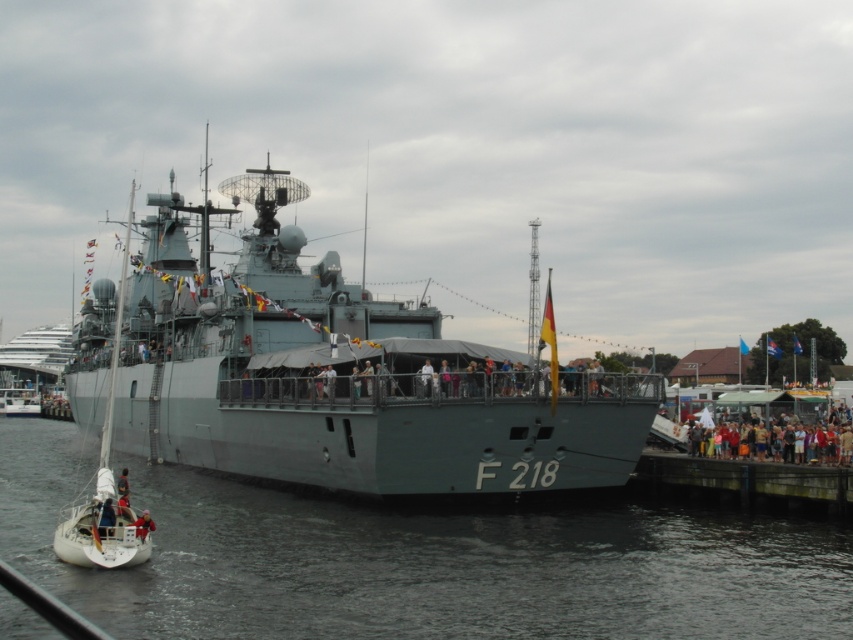
Can you confirm if gray metallic ship at center is positioned above light brown leather jacket at lower left?

Yes, gray metallic ship at center is above light brown leather jacket at lower left.

In the scene shown: Is gray metallic ship at center positioned in front of light brown leather jacket at lower left?

No, it is not.

Between point (117, 353) and point (142, 532), which one is positioned behind?

The point (117, 353) is more distant.

Where is `gray metallic ship at center`? The height and width of the screenshot is (640, 853). gray metallic ship at center is located at coordinates (329, 372).

Describe the element at coordinates (778, 428) in the screenshot. I see `multicolored casual clothing at lower right` at that location.

Is multicolored casual clothing at lower right positioned behind light brown leather jacket at lower left?

Yes, multicolored casual clothing at lower right is further from the viewer.

Which is behind, point (842, 451) or point (142, 518)?

Point (842, 451)

At what (x,y) coordinates should I click in order to perform the action: click on multicolored casual clothing at lower right. Please return your answer as a coordinate pair (x, y). Looking at the image, I should click on (778, 428).

Is gray water at center taller than gray metallic ship at center?

In fact, gray water at center may be shorter than gray metallic ship at center.

How much distance is there between gray water at center and gray metallic ship at center?

gray water at center is 13.99 meters from gray metallic ship at center.

Image resolution: width=853 pixels, height=640 pixels. What do you see at coordinates (419, 561) in the screenshot? I see `gray water at center` at bounding box center [419, 561].

I want to click on gray water at center, so click(419, 561).